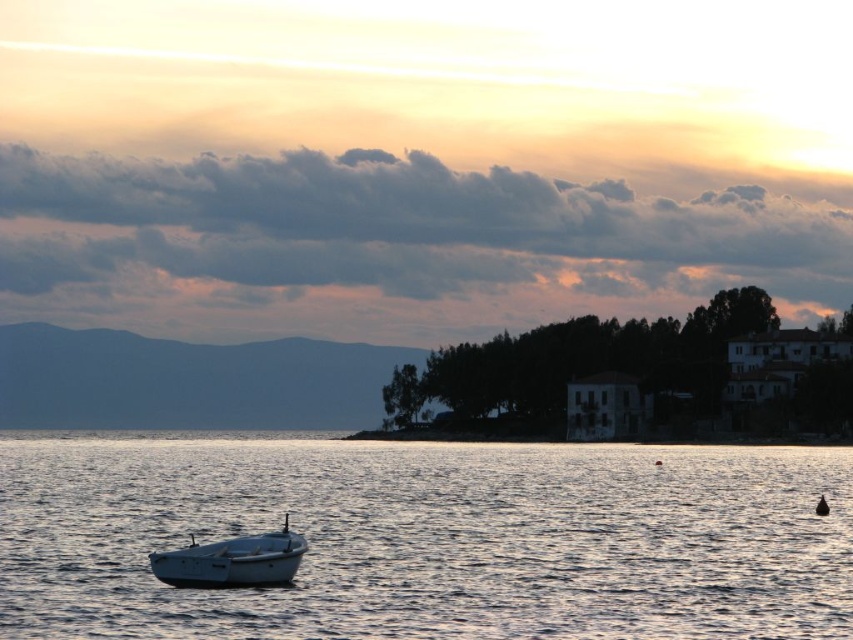
You are standing on the shore looking at the silvery water at boat left and the white matte boat at lower left. Which object appears taller in the scene?

The silvery water at boat left appears taller than the white matte boat at lower left in the scene.

You are standing on the beach and see two points in the image. One is at point (808, 452) and the other is at point (155, 576). Which point is closer to you?

Point (155, 576) is closer to you because it is in front of point (808, 452).

You are standing on the shore looking at the scene. Which object is closer to you between the silvery water at boat left and the white matte boat at lower left?

The silvery water at boat left is closer to you because it is in front of the white matte boat at lower left.